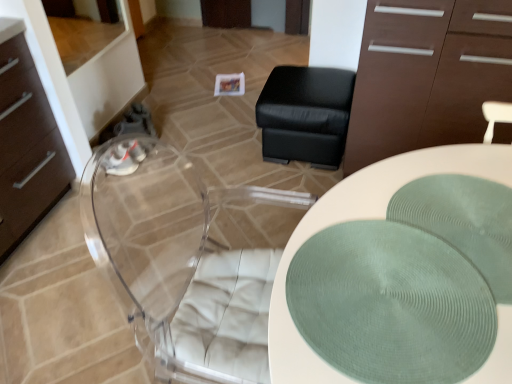
Question: Is transparent acrylic swivel chair at center taller or shorter than green textured placemat at center?

Choices:
 (A) tall
 (B) short

Answer: (A)

Question: Choose the correct answer: Is transparent acrylic swivel chair at center inside green textured placemat at center or outside it?

Choices:
 (A) inside
 (B) outside

Answer: (B)

Question: Which object is positioned farthest from the transparent acrylic swivel chair at center?

Choices:
 (A) white textured placemat at center
 (B) green textured placemat at center
 (C) brown matte cabinet at upper right
 (D) black leather ottoman at center

Answer: (B)

Question: Considering the real-world distances, which object is closest to the green textured placemat at center?

Choices:
 (A) brown matte cabinet at upper right
 (B) black leather ottoman at center
 (C) transparent acrylic swivel chair at center
 (D) white textured placemat at center

Answer: (D)